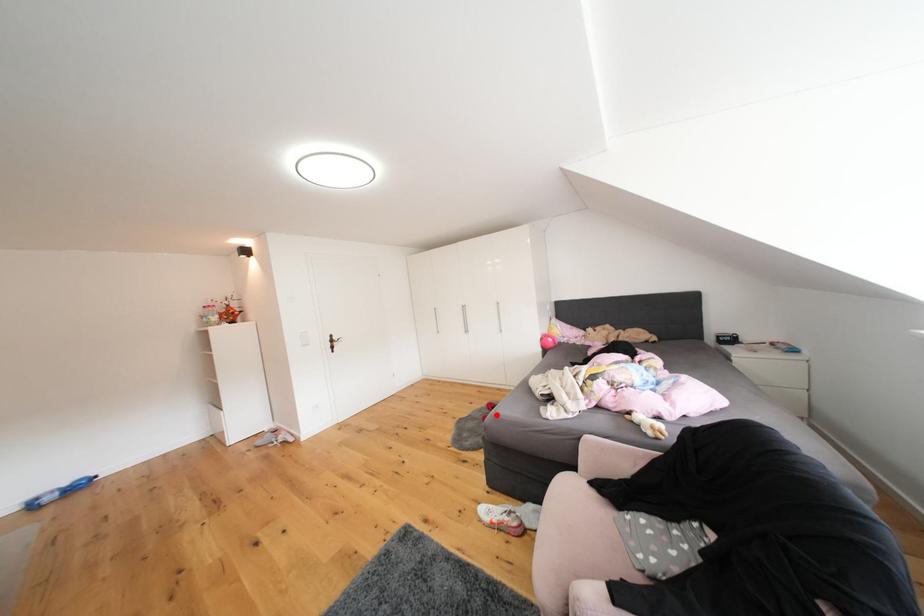
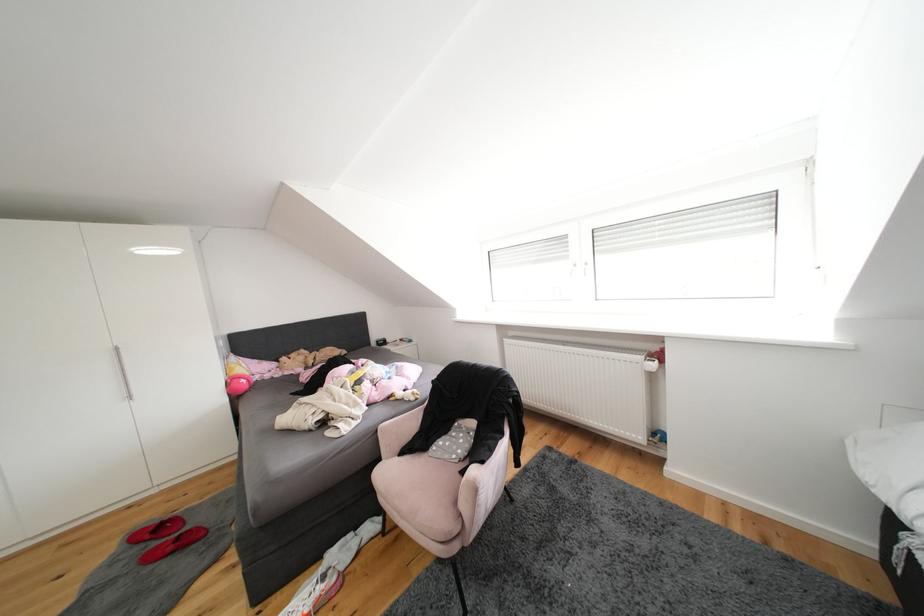
Question: I am providing you with two images of the same scene from different viewpoints. In image1, a red point is highlighted. Considering the same 3D point in image2, which of the following is correct?

Choices:
 (A) It is closer
 (B) It is farther

Answer: (A)